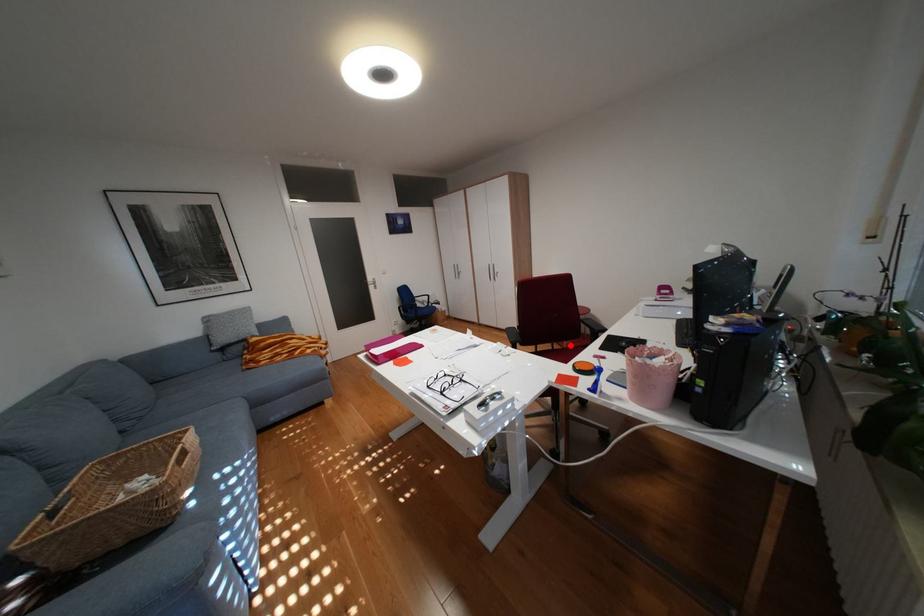
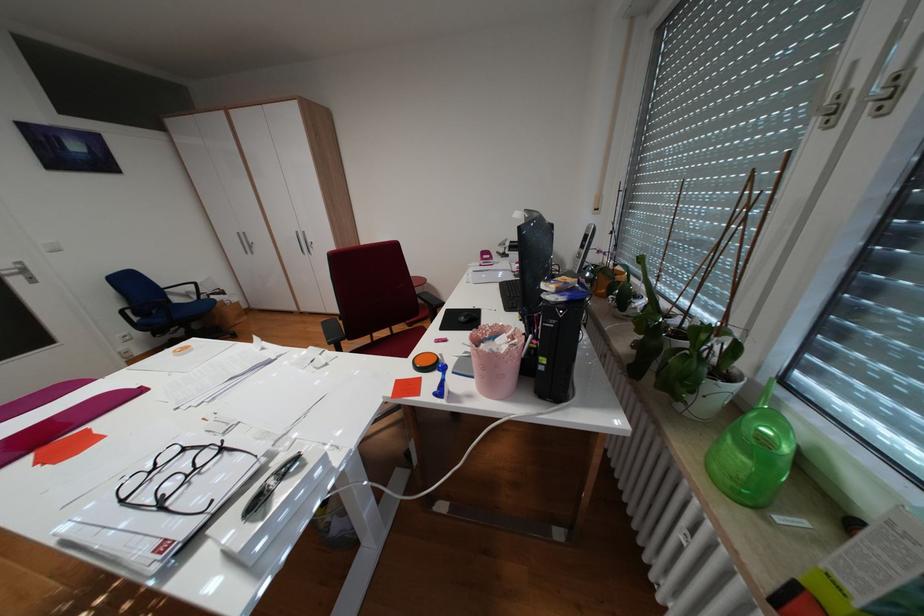
Question: A red point is marked in image1. In image2, is the corresponding 3D point closer to the camera or farther? Reply with the corresponding letter.

Choices:
 (A) The corresponding 3D point is closer.
 (B) The corresponding 3D point is farther.

Answer: (B)